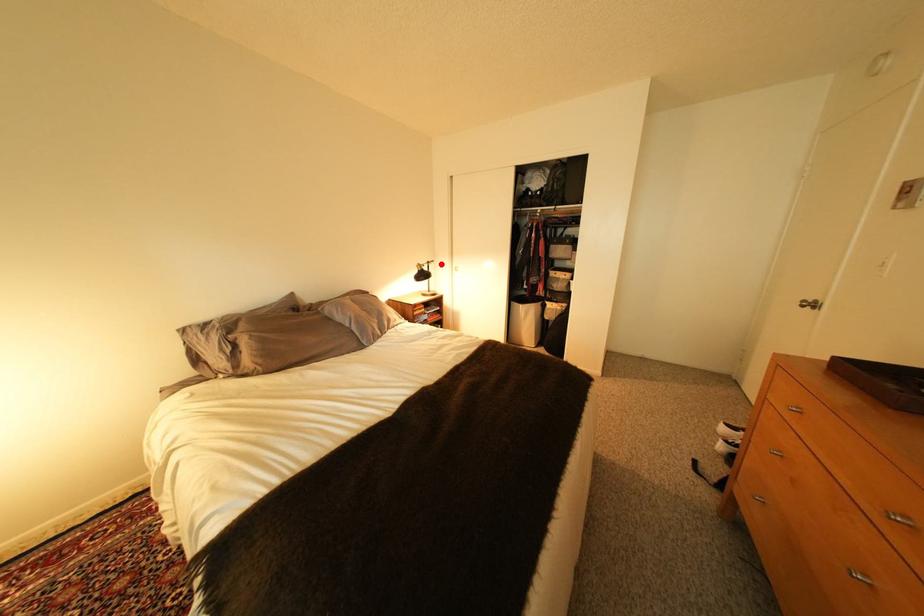
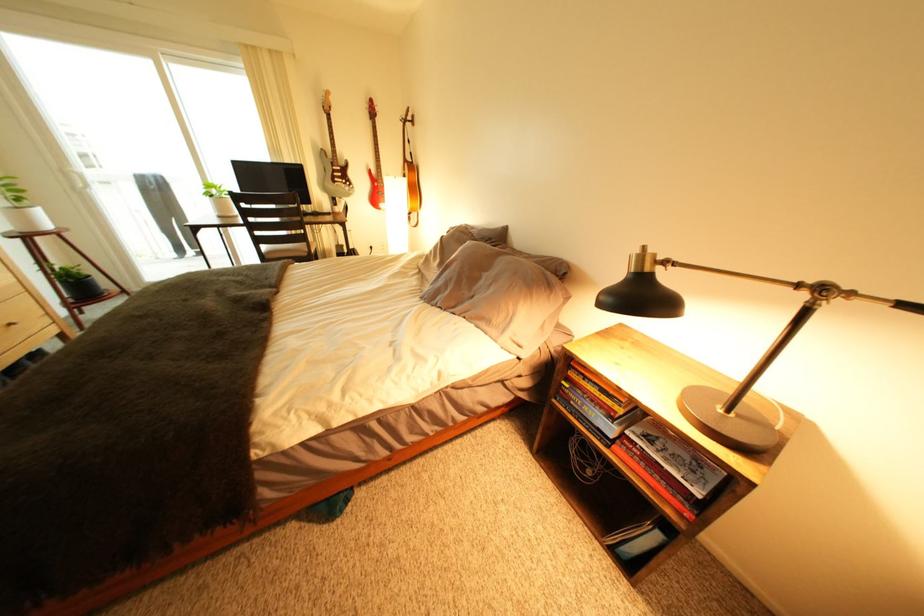
Question: I am providing you with two images of the same scene from different viewpoints. A red point is marked on the first image. Can you still see the location of the red point in image 2?

Choices:
 (A) Yes
 (B) No

Answer: (A)